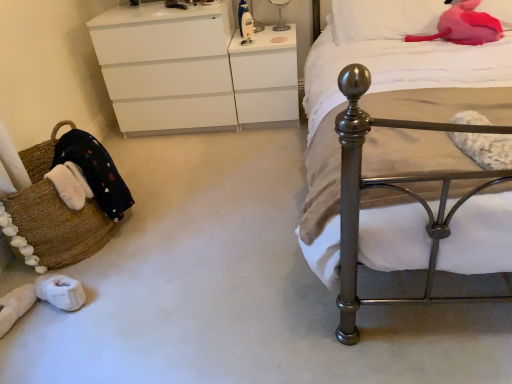
The width and height of the screenshot is (512, 384). In order to click on vacant region in front of white glossy changing table at upper center in this screenshot , I will do `click(260, 146)`.